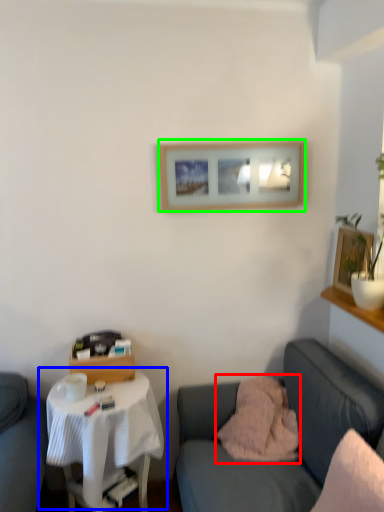
Question: Which object is positioned closest to pillow (highlighted by a red box)? Select from table (highlighted by a blue box) and picture frame (highlighted by a green box).

Choices:
 (A) table
 (B) picture frame

Answer: (A)